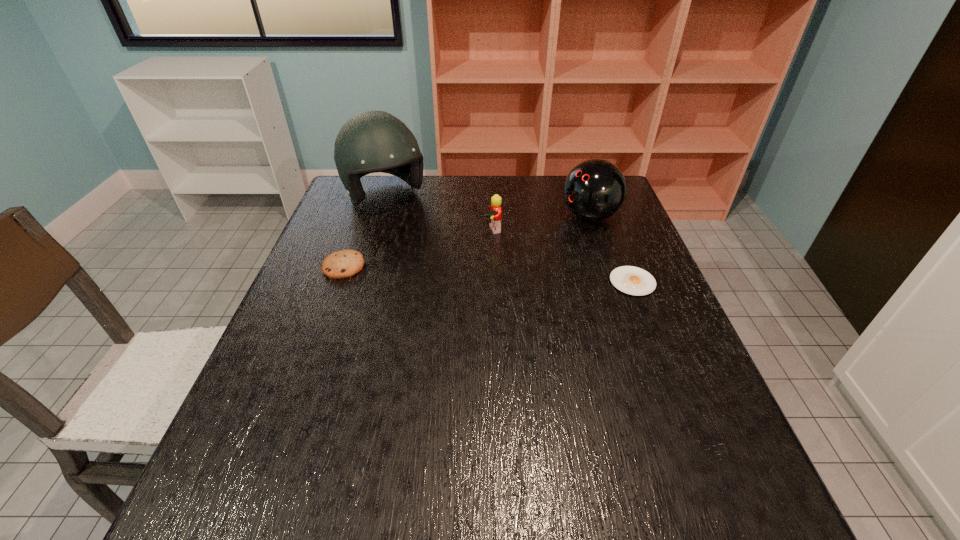
Where is `blank area located 0.300m at the face opening of the tallest object`? blank area located 0.300m at the face opening of the tallest object is located at coordinates (446, 274).

This screenshot has width=960, height=540. I want to click on vacant space located in front of the Lego with the accessory visible, so (513, 278).

Find the location of a particular element. free space located in front of the Lego with the accessory visible is located at coordinates (504, 261).

At what (x,y) coordinates should I click in order to perform the action: click on free space located 0.150m in front of the Lego with the accessory visible. Please return your answer as a coordinate pair (x, y). Looking at the image, I should click on (511, 273).

This screenshot has width=960, height=540. In order to click on free space located 0.340m on the surface of the second tallest object near the finger holes in this screenshot , I will do `click(468, 264)`.

Locate an element on the screen. This screenshot has width=960, height=540. vacant space situated on the surface of the second tallest object near the finger holes is located at coordinates (545, 233).

What are the coordinates of `blank space located 0.160m on the surface of the second tallest object near the finger holes` in the screenshot? It's located at 523,242.

Locate an element on the screen. football helmet at the far edge is located at coordinates (372, 141).

Locate an element on the screen. bowling ball that is at the far edge is located at coordinates (595, 189).

At what (x,y) coordinates should I click in order to perform the action: click on cookie positioned at the left edge. Please return your answer as a coordinate pair (x, y). The width and height of the screenshot is (960, 540). Looking at the image, I should click on (341, 264).